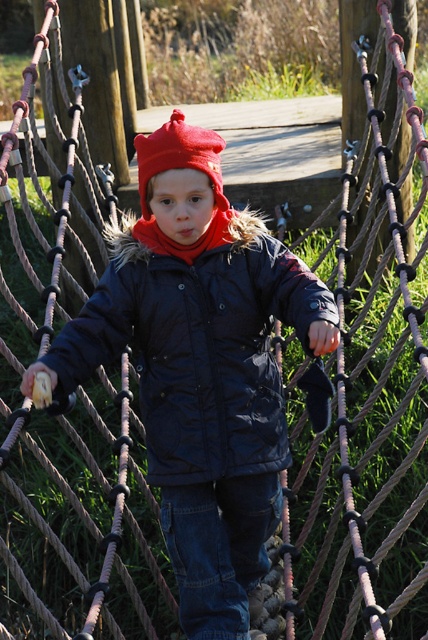
Between dark blue quilted jacket at center and red knitted hat at center, which one is positioned lower?

Positioned lower is dark blue quilted jacket at center.

Is dark blue quilted jacket at center further to the viewer compared to red knitted hat at center?

No, it is not.

What do you see at coordinates (199, 348) in the screenshot?
I see `dark blue quilted jacket at center` at bounding box center [199, 348].

I want to click on dark blue quilted jacket at center, so 199,348.